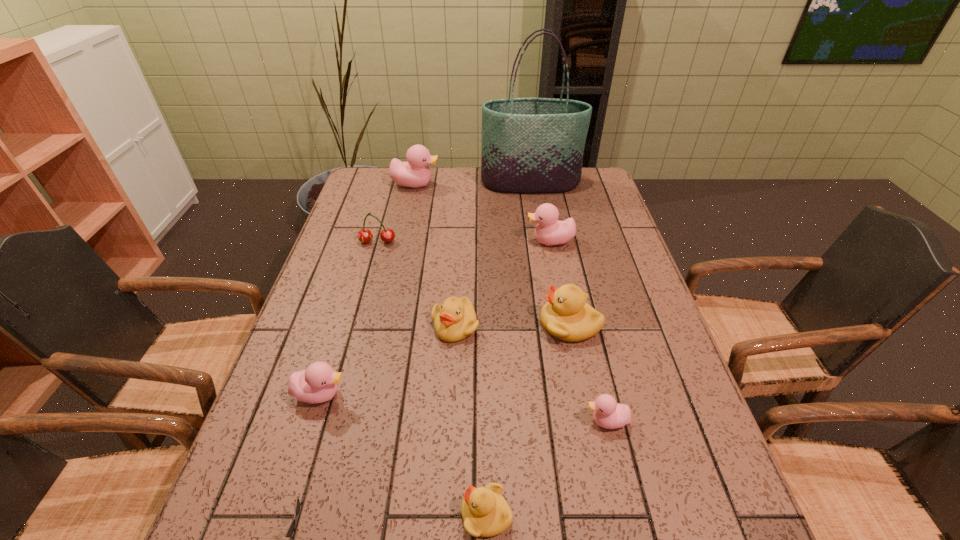
You are a GUI agent. You are given a task and a screenshot of the screen. Output one action in this format:
    pyautogui.click(x=<x>, y=<y>)
    Task: Click on the free space located on the front-facing side of the second smallest pink duckling
    
    Given the screenshot: What is the action you would take?
    pyautogui.click(x=459, y=394)

Where is `vacant space located 0.400m on the front-facing side of the second smallest yellow duckling`? The height and width of the screenshot is (540, 960). vacant space located 0.400m on the front-facing side of the second smallest yellow duckling is located at coordinates click(x=444, y=523).

Image resolution: width=960 pixels, height=540 pixels. In order to click on free spot located on the front-facing side of the smallest pink duckling in this screenshot , I will do `click(478, 421)`.

The width and height of the screenshot is (960, 540). In order to click on vacant region located 0.060m on the front-facing side of the smallest pink duckling in this screenshot , I will do `click(556, 421)`.

Find the location of a particular element. The height and width of the screenshot is (540, 960). free region located 0.340m on the front-facing side of the smallest pink duckling is located at coordinates (420, 421).

In order to click on tote bag located at the far edge in this screenshot , I will do `click(529, 145)`.

Where is `duckling that is at the far edge`? This screenshot has width=960, height=540. duckling that is at the far edge is located at coordinates (415, 173).

Where is `cherry located at the left edge`? The image size is (960, 540). cherry located at the left edge is located at coordinates 387,235.

Where is `tote bag present at the right edge`? tote bag present at the right edge is located at coordinates (529, 145).

Image resolution: width=960 pixels, height=540 pixels. Find the location of `object that is at the far left corner`. object that is at the far left corner is located at coordinates (415, 173).